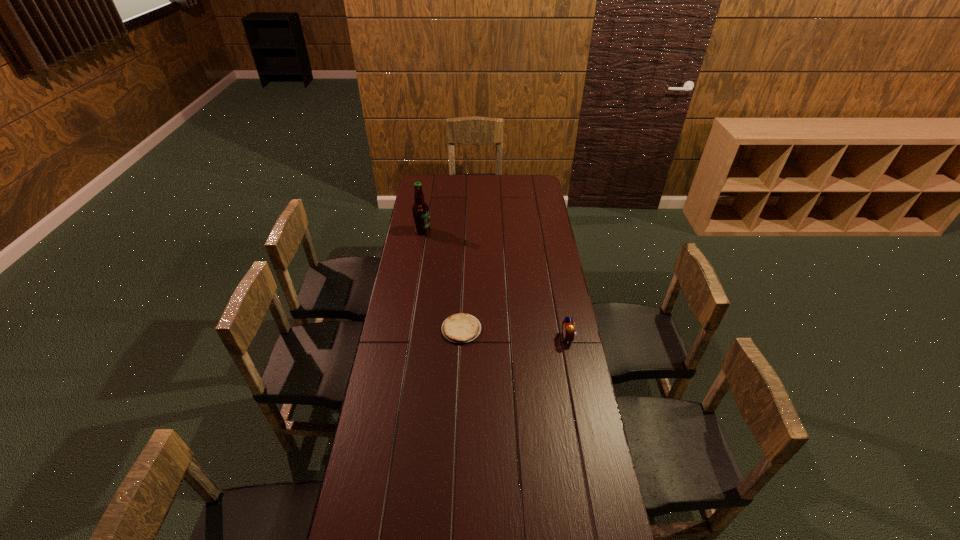
Find the location of a particular element. This screenshot has width=960, height=540. beer bottle is located at coordinates (420, 210).

Where is `the tallest object`? the tallest object is located at coordinates click(x=420, y=210).

Where is `the second tallest object`? The width and height of the screenshot is (960, 540). the second tallest object is located at coordinates (568, 328).

The width and height of the screenshot is (960, 540). I want to click on the rightmost object, so click(568, 328).

Locate an element on the screen. tortilla is located at coordinates (460, 328).

Find the location of a particular element. This screenshot has width=960, height=540. the second object from right to left is located at coordinates (460, 328).

Locate an element on the screen. This screenshot has width=960, height=540. free spot located 0.060m on the label of the beer bottle is located at coordinates (442, 231).

At what (x,y) coordinates should I click in order to perform the action: click on free location located 0.160m on the front-facing side of the alarm clock. Please return your answer as a coordinate pair (x, y). The width and height of the screenshot is (960, 540). Looking at the image, I should click on (524, 338).

Find the location of a particular element. This screenshot has height=540, width=960. vacant space located on the front-facing side of the alarm clock is located at coordinates (x=495, y=338).

You are a GUI agent. You are given a task and a screenshot of the screen. Output one action in this format:
    pyautogui.click(x=<x>, y=<y>)
    Task: Click on the vacant area situated 0.090m on the front-facing side of the alarm clock
    
    Given the screenshot: What is the action you would take?
    pyautogui.click(x=540, y=338)